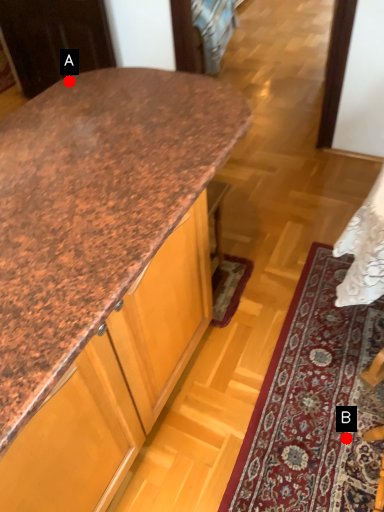
Question: Two points are circled on the image, labeled by A and B beside each circle. Which point is closer to the camera?

Choices:
 (A) A is closer
 (B) B is closer

Answer: (B)